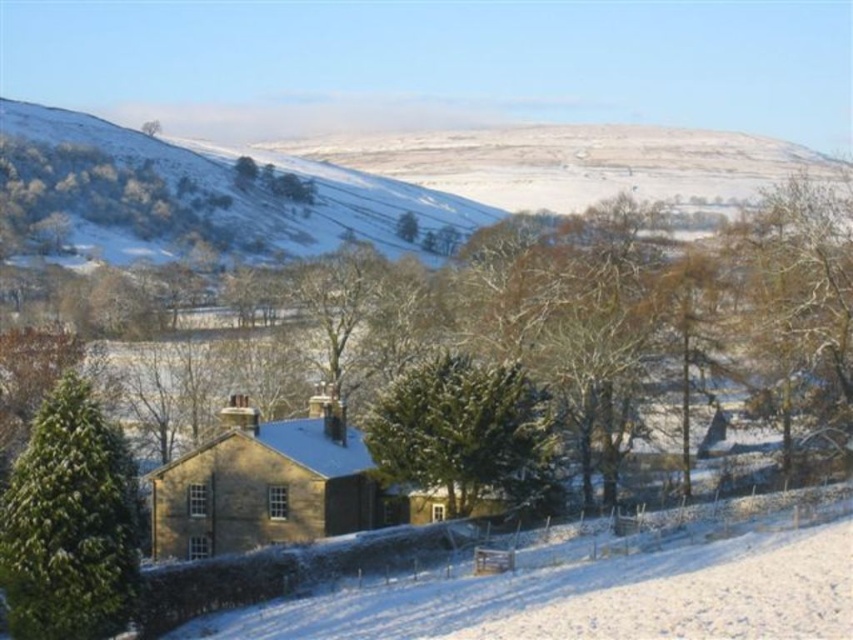
Which is more to the right, snowy grassland at upper left or green textured evergreen at center?

green textured evergreen at center

Measure the distance from snowy grassland at upper left to green textured evergreen at center.

The distance of snowy grassland at upper left from green textured evergreen at center is 159.41 feet.

Where is `snowy grassland at upper left`? This screenshot has width=853, height=640. snowy grassland at upper left is located at coordinates (263, 189).

Does green matte evergreen tree at center-left have a lesser width compared to snowy grassland at upper left?

Correct, green matte evergreen tree at center-left's width is less than snowy grassland at upper left's.

The width and height of the screenshot is (853, 640). I want to click on green matte evergreen tree at center-left, so click(x=70, y=524).

Is green matte evergreen tree at center-left bigger than green textured evergreen at center?

Yes.

Is green matte evergreen tree at center-left shorter than green textured evergreen at center?

Incorrect, green matte evergreen tree at center-left's height does not fall short of green textured evergreen at center's.

Find the location of a particular element. This screenshot has width=853, height=640. green matte evergreen tree at center-left is located at coordinates (70, 524).